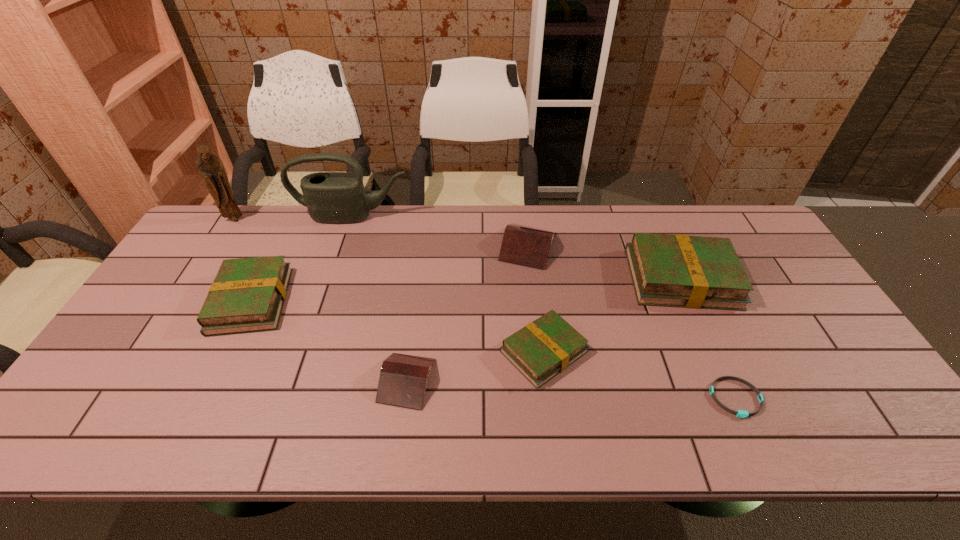
Where is `free space located 0.110m on the left of the fourth book from right to left`? The width and height of the screenshot is (960, 540). free space located 0.110m on the left of the fourth book from right to left is located at coordinates (334, 381).

The height and width of the screenshot is (540, 960). In order to click on vacant region located on the left of the smallest yellow book in this screenshot , I will do `click(472, 352)`.

This screenshot has width=960, height=540. I want to click on figurine located at the far edge, so click(x=209, y=166).

Locate an element on the screen. watering can that is at the far edge is located at coordinates (331, 197).

At what (x,y) coordinates should I click in order to perform the action: click on book present at the near edge. Please return your answer as a coordinate pair (x, y). The width and height of the screenshot is (960, 540). Looking at the image, I should click on 403,378.

You are a GUI agent. You are given a task and a screenshot of the screen. Output one action in this format:
    pyautogui.click(x=<x>, y=<y>)
    Task: Click on the wristband that is at the near edge
    The height and width of the screenshot is (540, 960).
    Given the screenshot: What is the action you would take?
    pyautogui.click(x=743, y=414)

At what (x,y) coordinates should I click in order to perform the action: click on object that is at the left edge. Please return your answer as a coordinate pair (x, y). Looking at the image, I should click on (209, 166).

In order to click on object at the far left corner in this screenshot , I will do `click(209, 166)`.

Find the location of a particular element. The width and height of the screenshot is (960, 540). vacant space at the far edge of the desktop is located at coordinates (677, 218).

In the image, there is a desktop. At what (x,y) coordinates should I click in order to perform the action: click on vacant area at the near edge. Please return your answer as a coordinate pair (x, y). The height and width of the screenshot is (540, 960). Looking at the image, I should click on pyautogui.click(x=466, y=420).